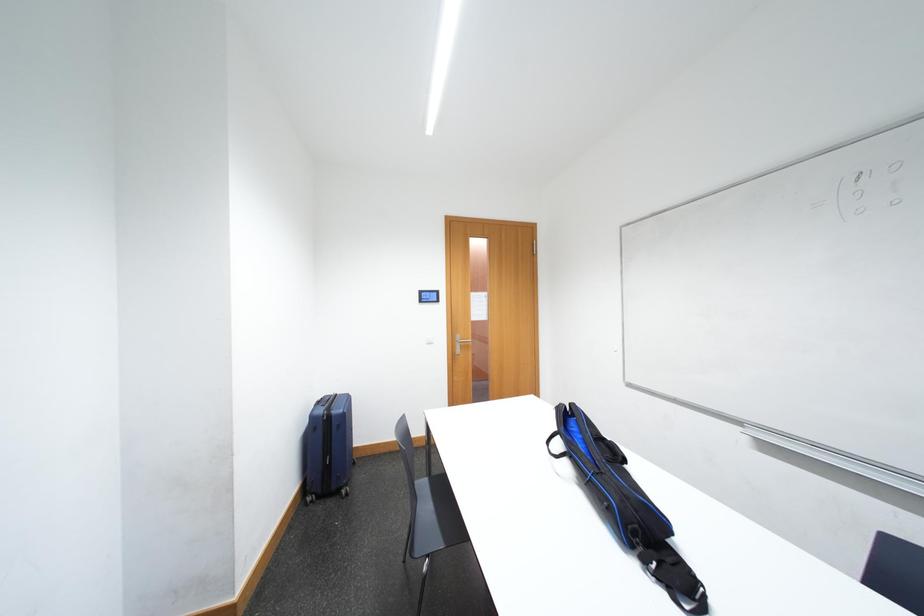
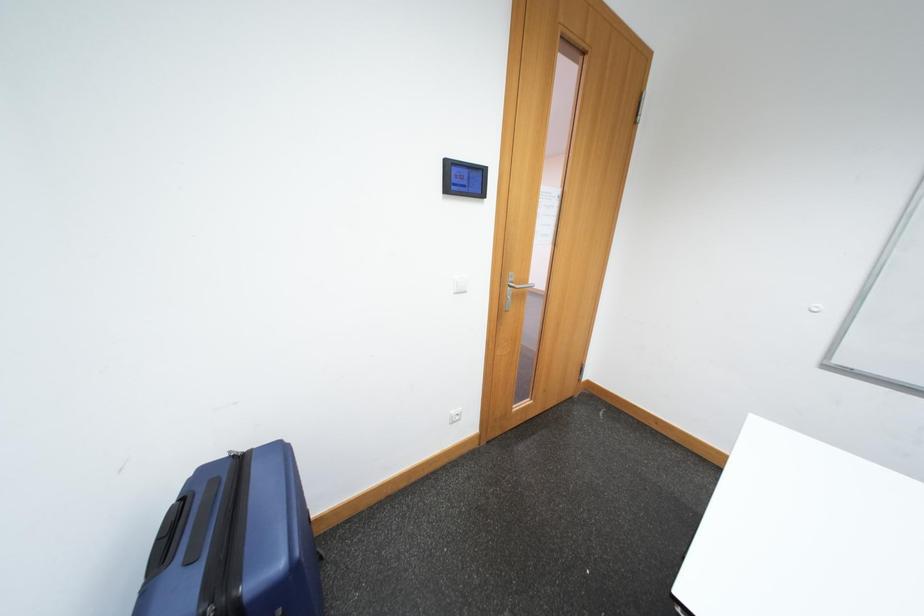
What movement of the cameraman would produce the second image?

The movement direction of the cameraman is left, forward.